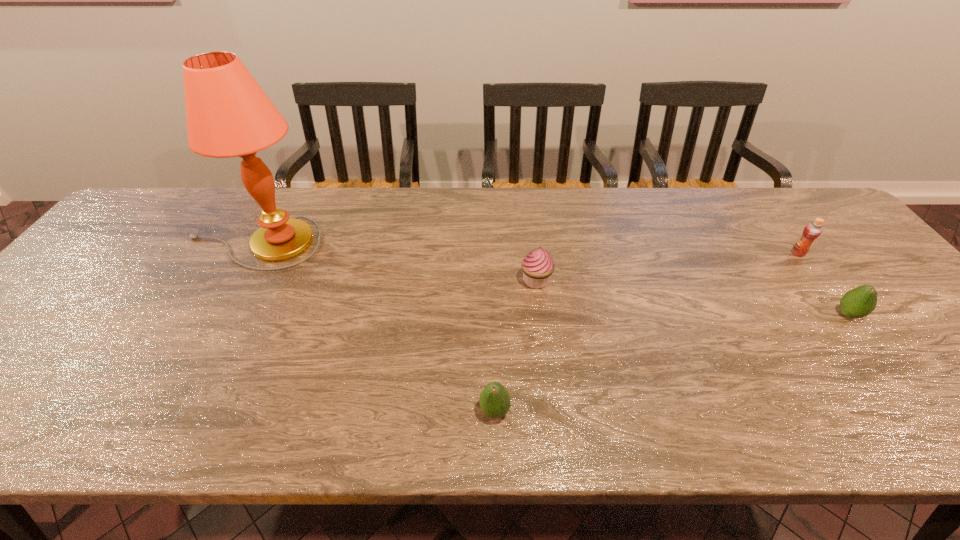
Find the location of `the tallest object`. the tallest object is located at coordinates (228, 114).

Find the location of a particular element. the leftmost object is located at coordinates (228, 114).

I want to click on orange juice, so click(812, 230).

Image resolution: width=960 pixels, height=540 pixels. Identify the location of cupcake. (538, 266).

Identify the location of the fourth farthest object. This screenshot has width=960, height=540. (859, 302).

I want to click on the farther avocado, so click(x=859, y=302).

Identify the location of the nearest object. (494, 400).

The image size is (960, 540). In order to click on the fourth object from right to left in this screenshot , I will do `click(494, 400)`.

Where is `vacant region located 0.270m on the front of the leftmost object`? vacant region located 0.270m on the front of the leftmost object is located at coordinates (190, 357).

This screenshot has width=960, height=540. What are the coordinates of `blank space located 0.070m on the right of the orange juice` in the screenshot? It's located at (830, 253).